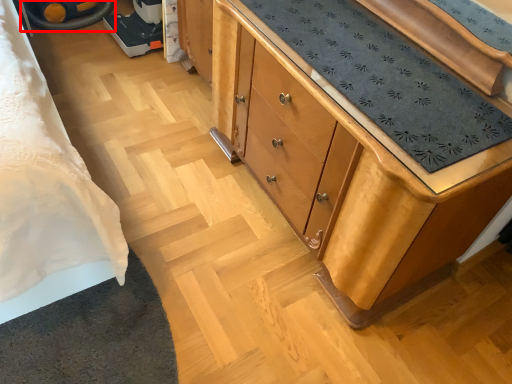
Question: Considering the relative positions of wheel (annotated by the red box) and chest of drawers in the image provided, where is wheel (annotated by the red box) located with respect to the staircase?

Choices:
 (A) left
 (B) right

Answer: (A)